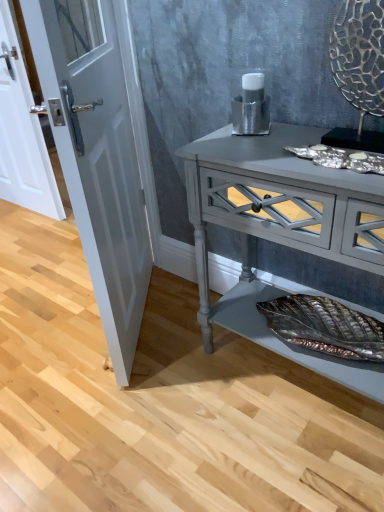
Find the location of `free space that is to the left of matte gray console table at center`. free space that is to the left of matte gray console table at center is located at coordinates (169, 396).